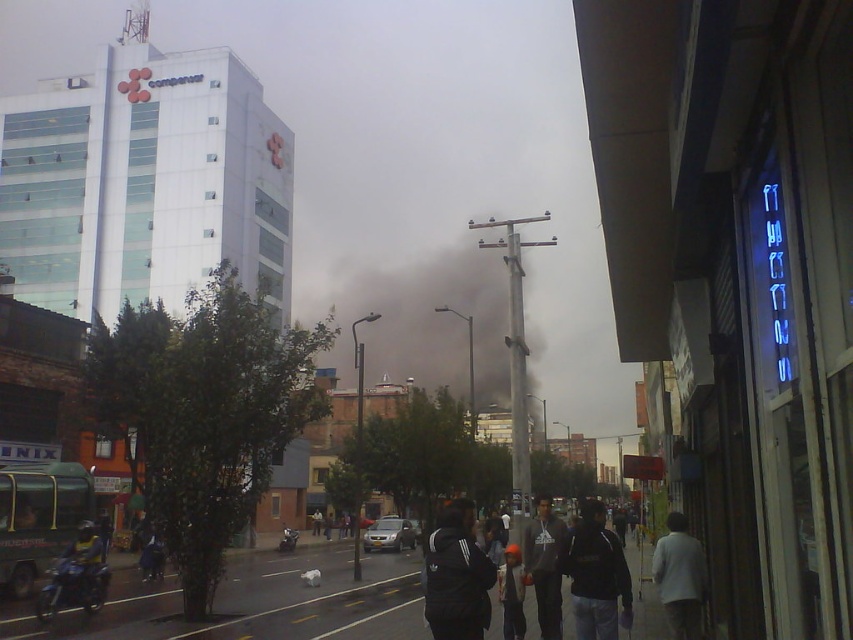
Question: Observing the image, what is the correct spatial positioning of black smoke at center in reference to black fabric jacket at center?

Choices:
 (A) left
 (B) right

Answer: (A)

Question: Which point appears farthest from the camera in this image?

Choices:
 (A) (589, 564)
 (B) (659, 579)

Answer: (B)

Question: Does black fabric jacket at center appear under white matte jacket at lower right?

Choices:
 (A) no
 (B) yes

Answer: (A)

Question: Among these points, which one is farthest from the camera?

Choices:
 (A) (547, 536)
 (B) (585, 563)

Answer: (A)

Question: Considering the real-world distances, which object is closest to the dark gray hoodie at center?

Choices:
 (A) white matte jacket at lower right
 (B) black matte jacket at lower center
 (C) black smoke at center
 (D) black fabric jacket at center

Answer: (B)

Question: Can you confirm if black smoke at center is positioned to the left of white matte jacket at lower right?

Choices:
 (A) yes
 (B) no

Answer: (A)